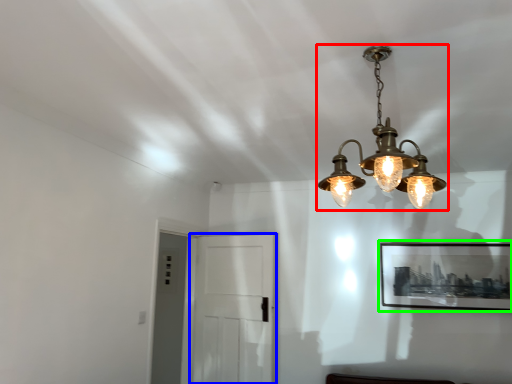
Question: Which object is the closest to the lamp (highlighted by a red box)? Choose among these: glass door (highlighted by a blue box) or picture frame (highlighted by a green box).

Choices:
 (A) glass door
 (B) picture frame

Answer: (B)